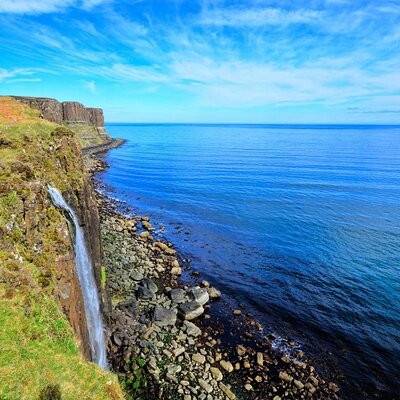
Find the location of a particular element. Image resolution: width=400 pixels, height=400 pixels. small plants is located at coordinates (136, 374), (104, 273), (121, 290).